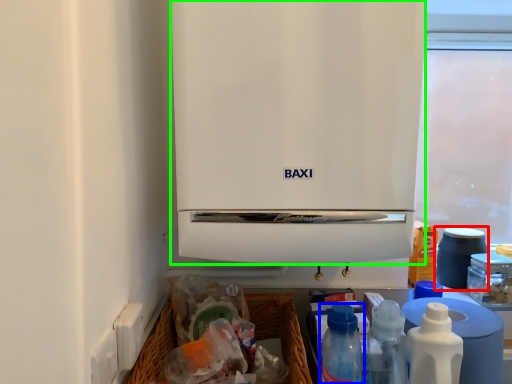
Question: Which object is the closest to the appliance (highlighted by a red box)? Choose among these: bottle (highlighted by a blue box) or home appliance (highlighted by a green box).

Choices:
 (A) bottle
 (B) home appliance

Answer: (A)